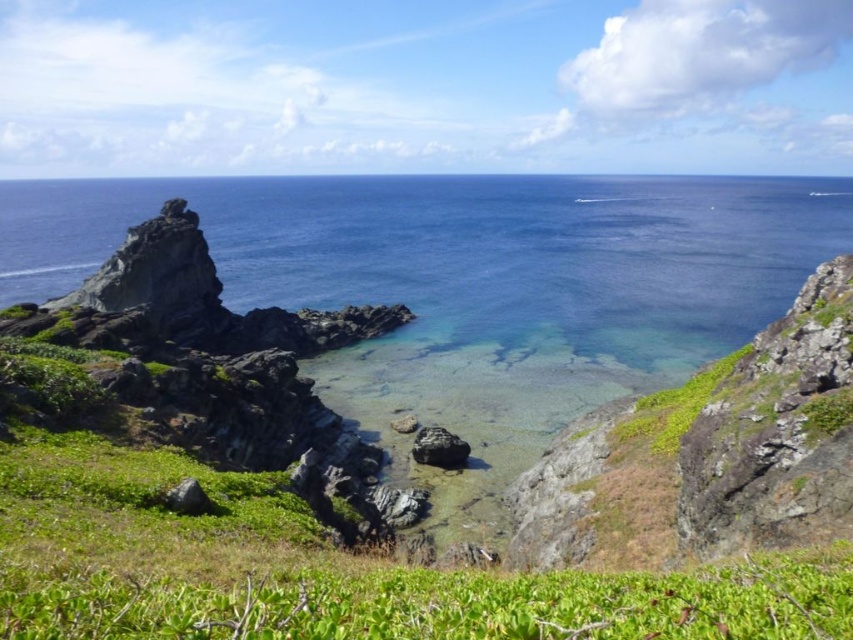
Which is in front, point (49, 608) or point (177, 486)?

Point (49, 608)

Based on the photo, how distant is green leafy grass at lower center from gray rock at lower left?

green leafy grass at lower center is 8.94 meters away from gray rock at lower left.

The height and width of the screenshot is (640, 853). Find the location of `green leafy grass at lower center`. green leafy grass at lower center is located at coordinates (445, 604).

Find the location of `green leafy grass at lower center`. green leafy grass at lower center is located at coordinates (445, 604).

Identify the location of green leafy grass at lower center. (445, 604).

Can you confirm if green leafy grass at lower center is positioned to the right of green leafy grass at lower right?

In fact, green leafy grass at lower center is to the left of green leafy grass at lower right.

Between point (650, 634) and point (706, 365), which one is positioned behind?

Point (706, 365)

The height and width of the screenshot is (640, 853). In order to click on green leafy grass at lower center in this screenshot , I will do `click(445, 604)`.

Consider the image. Is green leafy grass at lower right wider than smooth gray rock at center?

Indeed, green leafy grass at lower right has a greater width compared to smooth gray rock at center.

Between green leafy grass at lower right and smooth gray rock at center, which one is positioned higher?

Positioned higher is green leafy grass at lower right.

Does point (612, 438) lie in front of point (439, 442)?

Yes, point (612, 438) is in front of point (439, 442).

Locate an element on the screen. Image resolution: width=853 pixels, height=640 pixels. green leafy grass at lower right is located at coordinates (672, 406).